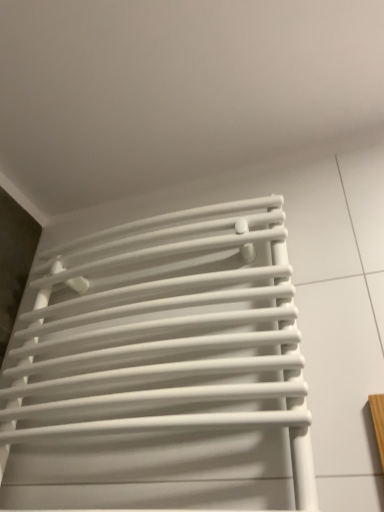
Question: Should I look upward or downward to see white matte radiator at center?

Choices:
 (A) down
 (B) up

Answer: (A)